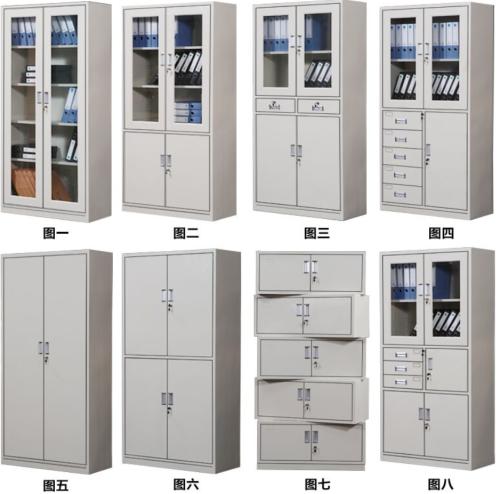
Identify the location of 4 door cabinet to left of center, bottom. This screenshot has width=500, height=494. point(191,346).